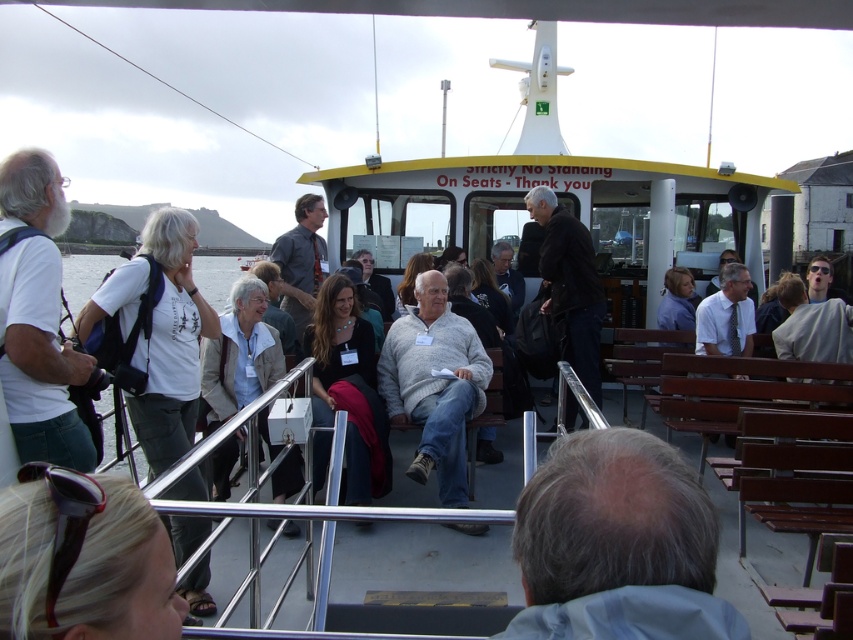
You are a passenger on the ferry and want to place a small bag on the seat. The shiny black sunglasses at upper left are in your way. Where should you move the sunglasses to make space?

Move the shiny black sunglasses at upper left from their current position at point (84, 561) to a different location on the seat to create space for your bag.

Consider the image. You are a photographer on the ferry deck and want to capture both the shiny black sunglasses at upper left and the dark gray shirt at center in a single photo. Which object should you position to the left side of your camera frame to include both?

To include both the shiny black sunglasses at upper left and the dark gray shirt at center in one photo, position the dark gray shirt at center on the left side of your camera frame since the sunglasses are to the right of the shirt.